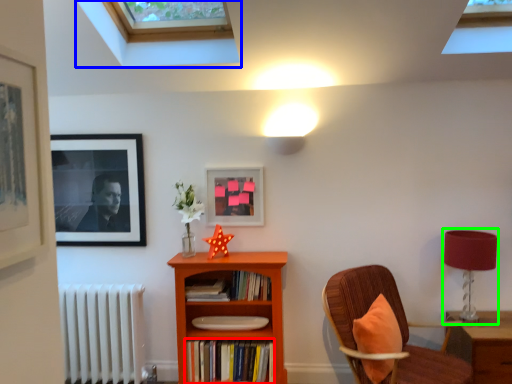
Question: Considering the real-world distances, which object is farthest from book (highlighted by a red box)? window (highlighted by a blue box) or table lamp (highlighted by a green box)?

Choices:
 (A) window
 (B) table lamp

Answer: (A)